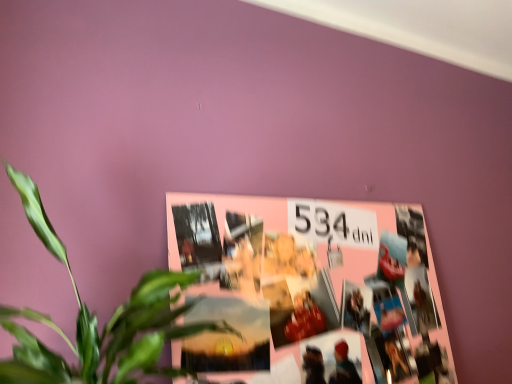
Question: Is pink paper collage at upper center at the right side of green leafy plant at center?

Choices:
 (A) yes
 (B) no

Answer: (A)

Question: Considering the relative positions of pink paper collage at upper center and green leafy plant at center in the image provided, is pink paper collage at upper center behind green leafy plant at center?

Choices:
 (A) yes
 (B) no

Answer: (A)

Question: Is green leafy plant at center inside pink paper collage at upper center?

Choices:
 (A) yes
 (B) no

Answer: (B)

Question: Is green leafy plant at center at the back of pink paper collage at upper center?

Choices:
 (A) no
 (B) yes

Answer: (A)

Question: Is pink paper collage at upper center far away from green leafy plant at center?

Choices:
 (A) yes
 (B) no

Answer: (B)

Question: Is pink paper collage at upper center thinner than green leafy plant at center?

Choices:
 (A) yes
 (B) no

Answer: (A)

Question: From the image's perspective, is green leafy plant at center located above pink paper collage at upper center?

Choices:
 (A) no
 (B) yes

Answer: (B)

Question: Can you confirm if green leafy plant at center is taller than pink paper collage at upper center?

Choices:
 (A) no
 (B) yes

Answer: (A)

Question: Considering the relative sizes of green leafy plant at center and pink paper collage at upper center in the image provided, is green leafy plant at center thinner than pink paper collage at upper center?

Choices:
 (A) yes
 (B) no

Answer: (B)

Question: Is green leafy plant at center placed right next to pink paper collage at upper center?

Choices:
 (A) no
 (B) yes

Answer: (A)

Question: Is green leafy plant at center looking in the opposite direction of pink paper collage at upper center?

Choices:
 (A) no
 (B) yes

Answer: (A)

Question: Is green leafy plant at center not close to pink paper collage at upper center?

Choices:
 (A) no
 (B) yes

Answer: (A)

Question: In terms of width, does pink paper collage at upper center look wider or thinner when compared to green leafy plant at center?

Choices:
 (A) wide
 (B) thin

Answer: (B)